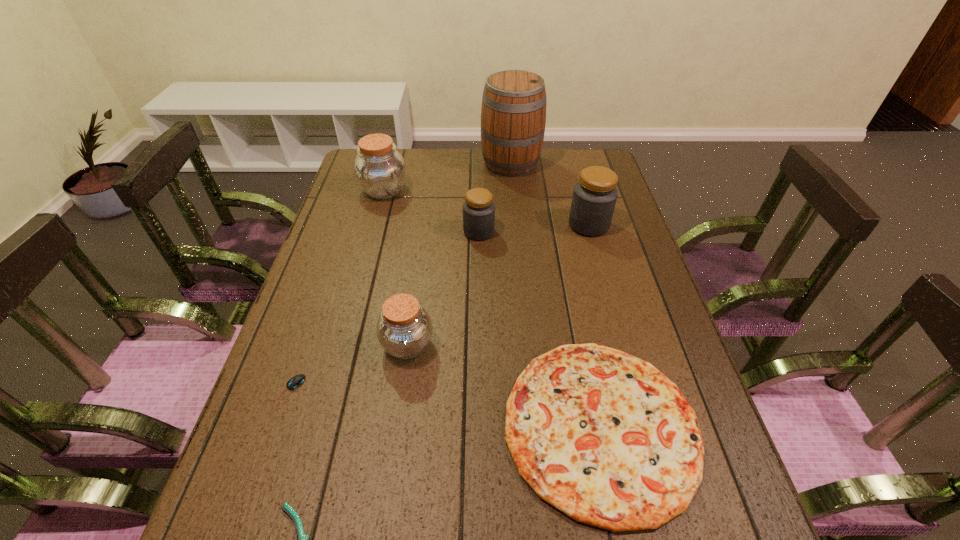
Identify the location of vacant space located on the back of the black mouse. The width and height of the screenshot is (960, 540). (331, 256).

You are a GUI agent. You are given a task and a screenshot of the screen. Output one action in this format:
    pyautogui.click(x=<x>, y=<y>)
    Task: Click on the cider that is at the far edge
    This screenshot has width=960, height=540.
    Given the screenshot: What is the action you would take?
    [513, 115]

Find the location of a particular element. Image resolution: width=960 pixels, height=540 pixels. jar that is at the far edge is located at coordinates (380, 170).

Identify the location of object that is at the near edge. Image resolution: width=960 pixels, height=540 pixels. (603, 436).

Where is `jar that is at the left edge`? jar that is at the left edge is located at coordinates (380, 170).

Where is `mouse positioned at the left edge`? This screenshot has width=960, height=540. mouse positioned at the left edge is located at coordinates (296, 381).

Where is `jar that is at the right edge`? Image resolution: width=960 pixels, height=540 pixels. jar that is at the right edge is located at coordinates (594, 198).

Identify the location of pizza at the right edge. The width and height of the screenshot is (960, 540). (603, 436).

Find the location of a particular element. This screenshot has height=540, width=960. object that is at the far left corner is located at coordinates (380, 170).

At what (x,y) coordinates should I click in order to perform the action: click on object at the near right corner. Please return your answer as a coordinate pair (x, y). The image size is (960, 540). Looking at the image, I should click on (603, 436).